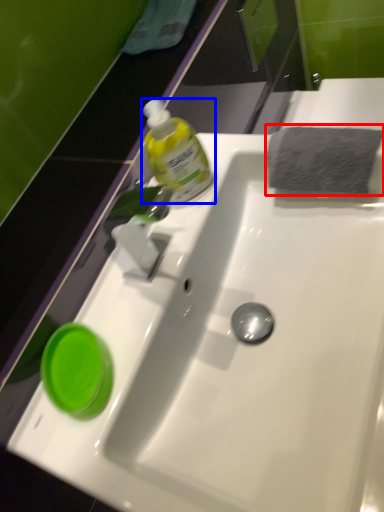
Question: Which object is further to the camera taking this photo, hand towel (highlighted by a red box) or bottle (highlighted by a blue box)?

Choices:
 (A) hand towel
 (B) bottle

Answer: (A)